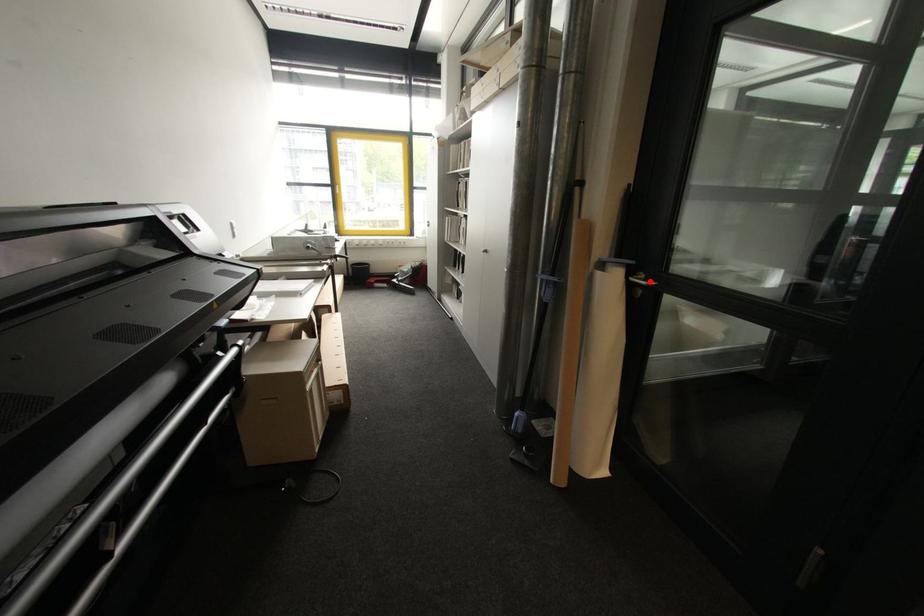
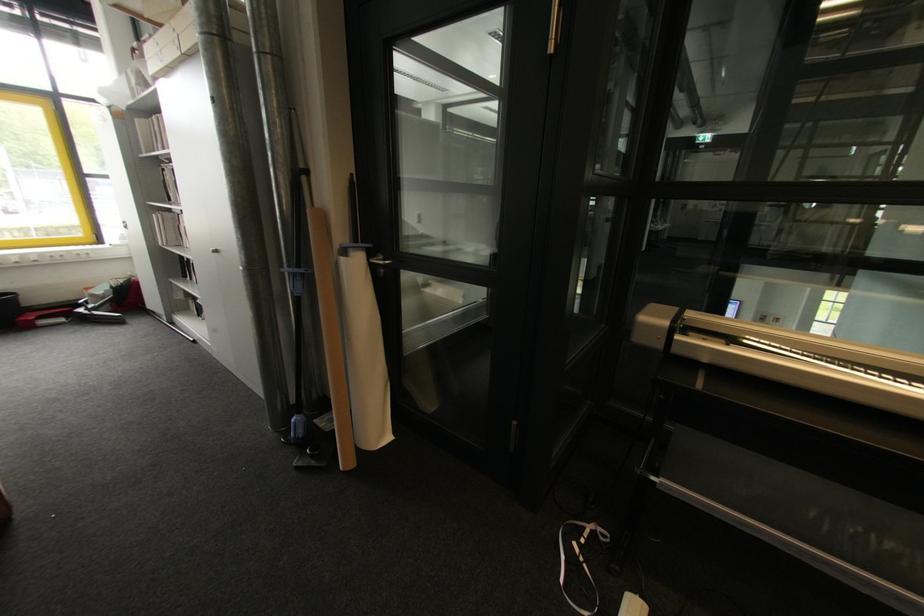
Find the pixel in the second image that matches the highlighted location in the first image.

(387, 261)